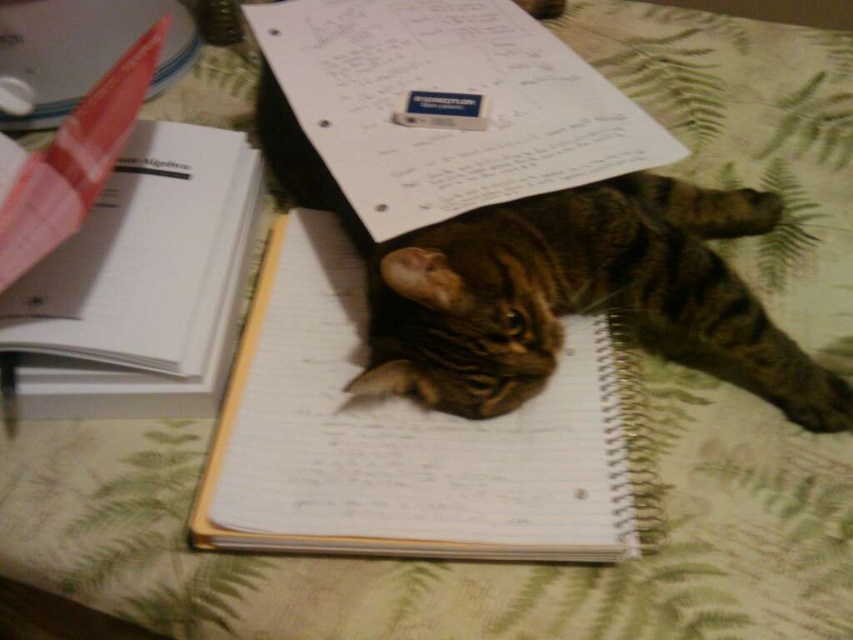
Describe the element at coordinates (581, 298) in the screenshot. I see `tabby fur cat at center` at that location.

Does tabby fur cat at center appear on the right side of white paper notebook at upper left?

Indeed, tabby fur cat at center is positioned on the right side of white paper notebook at upper left.

Is point (520, 252) more distant than point (193, 337)?

That is False.

Where is `tabby fur cat at center`? This screenshot has width=853, height=640. tabby fur cat at center is located at coordinates (581, 298).

Where is `spiral-bound paper notebook at center`? spiral-bound paper notebook at center is located at coordinates (401, 438).

Is spiral-bound paper notebook at center below white paper notebook at upper left?

Yes.

Does point (595, 472) come in front of point (126, 400)?

Yes, it is in front of point (126, 400).

Locate an element on the screen. spiral-bound paper notebook at center is located at coordinates point(401,438).

Who is higher up, tabby fur cat at center or white paper at center?

Positioned higher is white paper at center.

Between point (480, 342) and point (646, 145), which one is positioned behind?

The point (646, 145) is more distant.

Is point (421, 307) positioned behind point (524, 38)?

No, it is not.

The image size is (853, 640). I want to click on tabby fur cat at center, so click(581, 298).